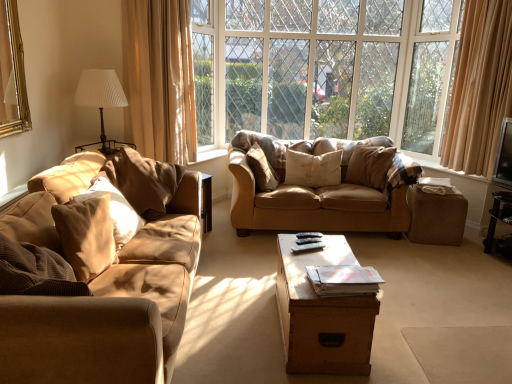
Find the location of a particular element. free space on the front side of brown fabric stool at right is located at coordinates (437, 249).